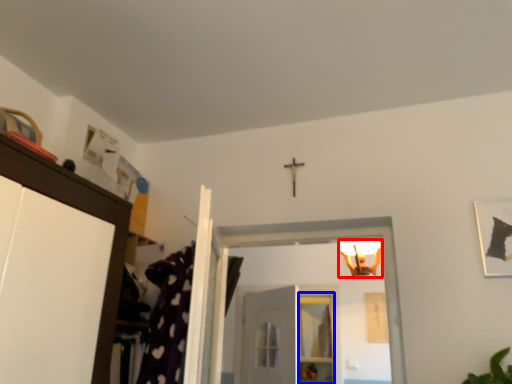
Question: Which point is closer to the camera, light fixture (highlighted by a red box) or shelf (highlighted by a blue box)?

Choices:
 (A) light fixture
 (B) shelf

Answer: (A)